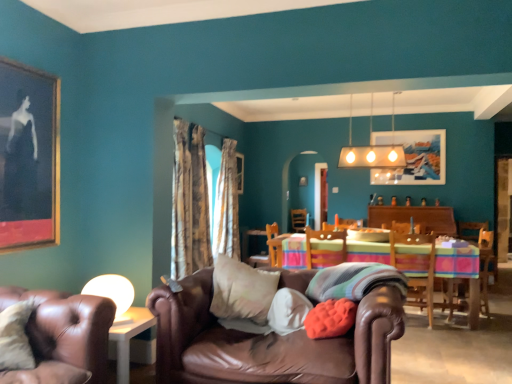
Question: Does brown leather couch at lower left, the fourth chair from the right, lie in front of wooden framed artwork at upper center, the second picture frame in the back-to-front sequence?

Choices:
 (A) no
 (B) yes

Answer: (B)

Question: From the image's perspective, is brown leather couch at lower left, which is the first chair in left-to-right order, located beneath wooden framed artwork at upper center, which ranks as the first picture frame in right-to-left order?

Choices:
 (A) no
 (B) yes

Answer: (B)

Question: From a real-world perspective, is brown leather couch at lower left, the 1th chair viewed from the front, positioned under wooden framed artwork at upper center, which ranks as the first picture frame in right-to-left order, based on gravity?

Choices:
 (A) yes
 (B) no

Answer: (A)

Question: Is brown leather couch at lower left, the fourth chair from the right, smaller than wooden framed artwork at upper center, which ranks as the 3th picture frame in left-to-right order?

Choices:
 (A) yes
 (B) no

Answer: (B)

Question: Is there a large distance between brown leather couch at lower left, the 1th chair viewed from the front, and wooden framed artwork at upper center, which ranks as the 3th picture frame in left-to-right order?

Choices:
 (A) yes
 (B) no

Answer: (A)

Question: Considering the positions of wooden chair at center, positioned as the second chair in left-to-right order, and wooden chair at right, the 3th chair viewed from the back, in the image, is wooden chair at center, positioned as the second chair in left-to-right order, bigger or smaller than wooden chair at right, the 3th chair viewed from the back,?

Choices:
 (A) big
 (B) small

Answer: (A)

Question: In terms of width, does wooden chair at center, placed as the third chair when sorted from right to left, look wider or thinner when compared to wooden chair at right, positioned as the second chair in front-to-back order?

Choices:
 (A) wide
 (B) thin

Answer: (B)

Question: Does point (268, 228) appear closer or farther from the camera than point (415, 268)?

Choices:
 (A) closer
 (B) farther

Answer: (B)

Question: Considering their positions, is wooden chair at center, the fourth chair from the front, located in front of or behind wooden chair at right, positioned as the second chair in front-to-back order?

Choices:
 (A) front
 (B) behind

Answer: (B)

Question: In terms of size, does matte gold rectangular light fixture at upper center appear bigger or smaller than striped fabric pillow at center, positioned as the first pillow in right-to-left order?

Choices:
 (A) big
 (B) small

Answer: (A)

Question: From their relative heights in the image, would you say matte gold rectangular light fixture at upper center is taller or shorter than striped fabric pillow at center, positioned as the first pillow in right-to-left order?

Choices:
 (A) tall
 (B) short

Answer: (A)

Question: Is matte gold rectangular light fixture at upper center inside or outside of striped fabric pillow at center, placed as the 4th pillow when sorted from left to right?

Choices:
 (A) inside
 (B) outside

Answer: (B)

Question: In the image, is matte gold rectangular light fixture at upper center on the left side or the right side of striped fabric pillow at center, placed as the 4th pillow when sorted from left to right?

Choices:
 (A) right
 (B) left

Answer: (A)

Question: Considering the positions of point (345, 329) and point (268, 370), is point (345, 329) closer or farther from the camera than point (268, 370)?

Choices:
 (A) closer
 (B) farther

Answer: (B)

Question: Visually, is soft coral cushion at center, positioned as the third pillow in left-to-right order, positioned to the left or to the right of brown leather couch at center?

Choices:
 (A) right
 (B) left

Answer: (A)